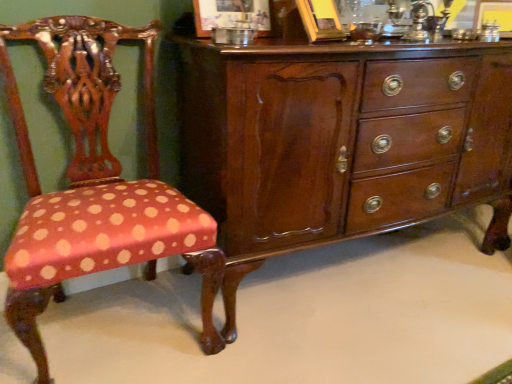
Question: From the image's perspective, is mahogany wood chest of drawers at center on polka dot fabric chair at left?

Choices:
 (A) no
 (B) yes

Answer: (B)

Question: Is the surface of mahogany wood chest of drawers at center in direct contact with polka dot fabric chair at left?

Choices:
 (A) yes
 (B) no

Answer: (B)

Question: Is mahogany wood chest of drawers at center to the left of polka dot fabric chair at left from the viewer's perspective?

Choices:
 (A) yes
 (B) no

Answer: (B)

Question: Considering the relative sizes of mahogany wood chest of drawers at center and polka dot fabric chair at left in the image provided, is mahogany wood chest of drawers at center bigger than polka dot fabric chair at left?

Choices:
 (A) yes
 (B) no

Answer: (A)

Question: Would you say mahogany wood chest of drawers at center contains polka dot fabric chair at left?

Choices:
 (A) no
 (B) yes

Answer: (A)

Question: Can you confirm if mahogany wood chest of drawers at center is wider than polka dot fabric chair at left?

Choices:
 (A) yes
 (B) no

Answer: (A)

Question: Is polka dot fabric chair at left positioned behind mahogany wood chest of drawers at center?

Choices:
 (A) no
 (B) yes

Answer: (A)

Question: From a real-world perspective, is polka dot fabric chair at left positioned over mahogany wood chest of drawers at center based on gravity?

Choices:
 (A) no
 (B) yes

Answer: (B)

Question: Does polka dot fabric chair at left have a greater width compared to mahogany wood chest of drawers at center?

Choices:
 (A) yes
 (B) no

Answer: (B)

Question: Does polka dot fabric chair at left come in front of mahogany wood chest of drawers at center?

Choices:
 (A) yes
 (B) no

Answer: (A)

Question: Is polka dot fabric chair at left not inside mahogany wood chest of drawers at center?

Choices:
 (A) yes
 (B) no

Answer: (A)

Question: Is polka dot fabric chair at left far away from mahogany wood chest of drawers at center?

Choices:
 (A) no
 (B) yes

Answer: (A)

Question: From a real-world perspective, is mahogany wood chest of drawers at center positioned above or below polka dot fabric chair at left?

Choices:
 (A) below
 (B) above

Answer: (A)